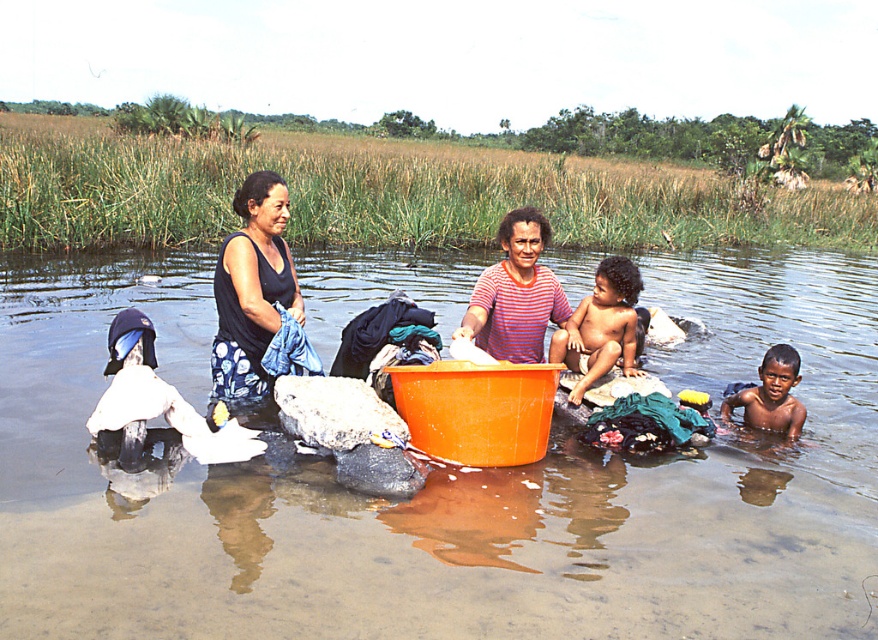
Question: Is dark brown skin at center bigger than dark brown skin boy at lower right?

Choices:
 (A) yes
 (B) no

Answer: (A)

Question: Estimate the real-world distances between objects in this image. Which object is farther from the clear water at center?

Choices:
 (A) dark brown skin boy at lower right
 (B) black fabric at center
 (C) striped cotton shirt at center

Answer: (C)

Question: Which point is closer to the camera?

Choices:
 (A) black fabric at center
 (B) clear water at center
 (C) dark brown skin boy at lower right

Answer: (B)

Question: Does black fabric at center have a greater width compared to dark brown skin boy at lower right?

Choices:
 (A) no
 (B) yes

Answer: (B)

Question: Observing the image, what is the correct spatial positioning of clear water at center in reference to striped cotton shirt at center?

Choices:
 (A) below
 (B) above

Answer: (A)

Question: Which point appears closest to the camera in this image?

Choices:
 (A) (495, 353)
 (B) (222, 362)

Answer: (B)